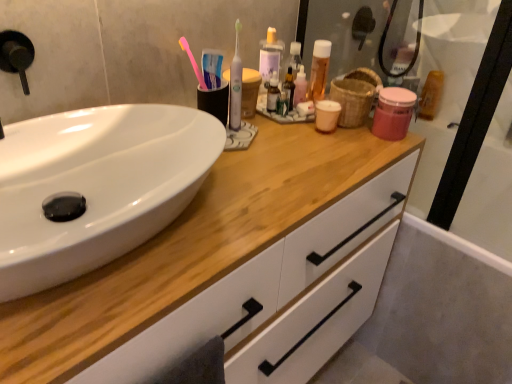
Locate an element on the screen. vacant area that lies between white glossy toothbrush at center, which is counted as the 1th toothbrush, starting from the right, and pink matte jar at upper right, which is the 1th mouthwash in front-to-back order is located at coordinates (325, 134).